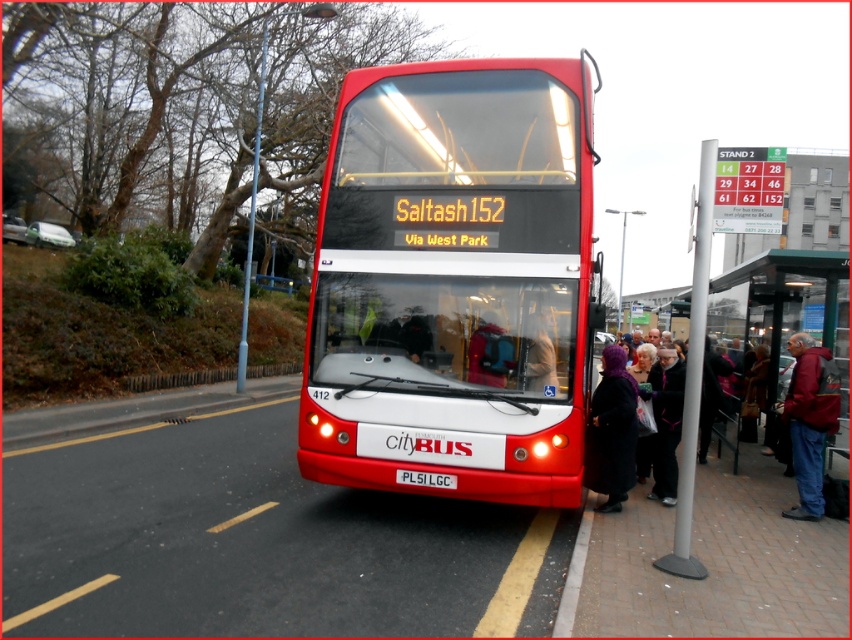
Question: Is metallic pole at center right further to camera compared to velvet purple scarf at lower center?

Choices:
 (A) no
 (B) yes

Answer: (A)

Question: Is red leather jacket at lower right positioned at the back of dark purple knit hat at lower right?

Choices:
 (A) yes
 (B) no

Answer: (B)

Question: Among these points, which one is farthest from the camera?

Choices:
 (A) (419, 472)
 (B) (404, 444)
 (C) (810, 460)
 (D) (602, 472)

Answer: (C)

Question: Which object is closer to the camera taking this photo?

Choices:
 (A) metallic pole at center right
 (B) white plastic license plate at center
 (C) velvet purple scarf at lower center
 (D) shiny red bus at center

Answer: (A)

Question: Which point is farther to the camera?

Choices:
 (A) metallic pole at center right
 (B) white plastic license plate at center
 (C) velvet purple scarf at lower center

Answer: (C)

Question: Is metallic pole at center right behind red leather jacket at lower right?

Choices:
 (A) yes
 (B) no

Answer: (B)